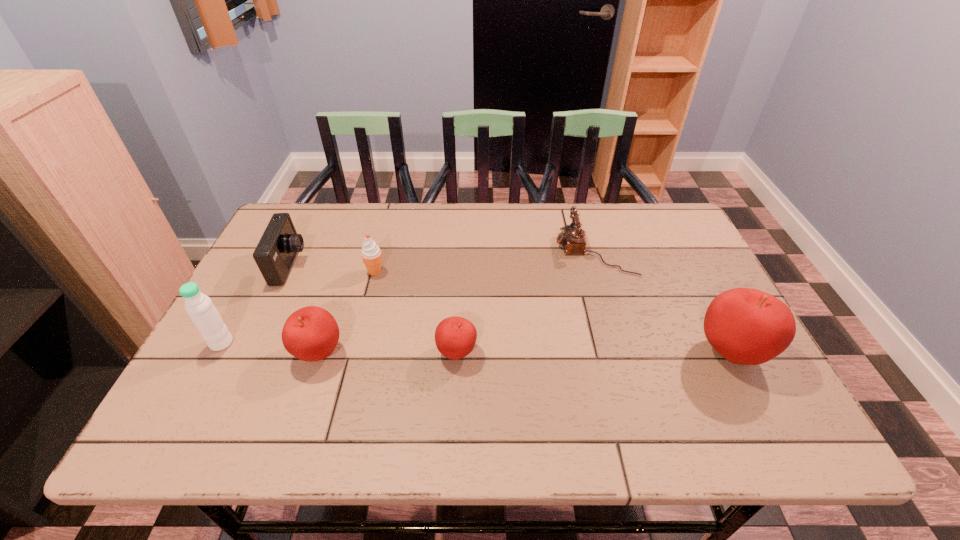
Locate an element on the screen. The height and width of the screenshot is (540, 960). the second tallest apple is located at coordinates (311, 333).

Identify the location of the fifth object from left to right. This screenshot has width=960, height=540. (455, 337).

Locate an element on the screen. the second apple from left to right is located at coordinates (455, 337).

Locate an element on the screen. the rightmost apple is located at coordinates (746, 326).

I want to click on the rightmost object, so click(x=746, y=326).

At what (x,y) coordinates should I click in order to perform the action: click on the sixth object from left to right. Please return your answer as a coordinate pair (x, y). This screenshot has width=960, height=540. Looking at the image, I should click on (572, 239).

You are a GUI agent. You are given a task and a screenshot of the screen. Output one action in this format:
    pyautogui.click(x=<x>, y=<y>)
    Task: Click on the icecream
    The width and height of the screenshot is (960, 540).
    Given the screenshot: What is the action you would take?
    pyautogui.click(x=371, y=253)

Where is `camera`? The image size is (960, 540). camera is located at coordinates (275, 253).

This screenshot has height=540, width=960. Identify the location of water bottle. (204, 315).

This screenshot has width=960, height=540. I want to click on free space located 0.110m on the left of the second shortest apple, so click(247, 353).